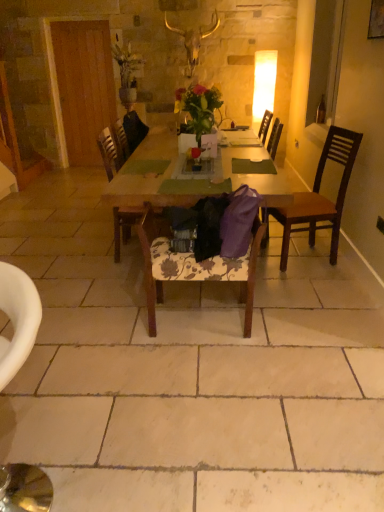
Image resolution: width=384 pixels, height=512 pixels. In order to click on vacant space positioned to the left of floral fabric chair at center, which is the 3th chair in back-to-front order in this screenshot , I will do `click(110, 330)`.